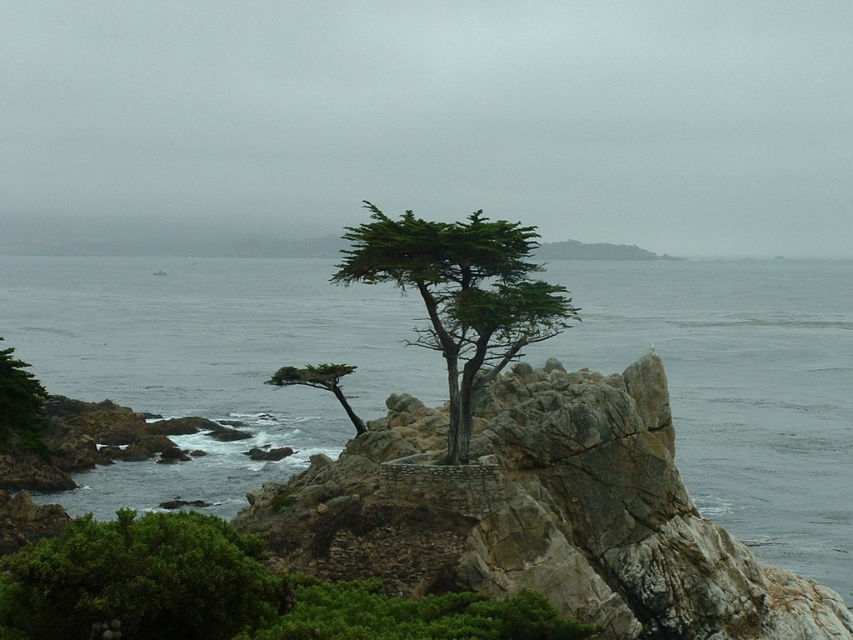
Is point (125, 268) closer to viewer compared to point (448, 340)?

No, (125, 268) is further to viewer.

This screenshot has width=853, height=640. Find the location of `gray water at center`. gray water at center is located at coordinates (209, 358).

Can you confirm if gray water at center is positioned below green matte tree at center?

No, gray water at center is not below green matte tree at center.

Can you confirm if gray water at center is wider than green matte tree at center?

Yes.

Is point (119, 387) positioned behind point (294, 380)?

Yes, point (119, 387) is farther from viewer.

What are the coordinates of `gray water at center` in the screenshot? It's located at [x=209, y=358].

Is gray water at center positioned in front of green textured tree at lower left?

Yes, it is in front of green textured tree at lower left.

Based on the photo, can you confirm if gray water at center is positioned below green textured tree at lower left?

Incorrect, gray water at center is not positioned below green textured tree at lower left.

Is point (828, 316) positioned after point (15, 397)?

That is True.

Where is `gray water at center`? gray water at center is located at coordinates (209, 358).